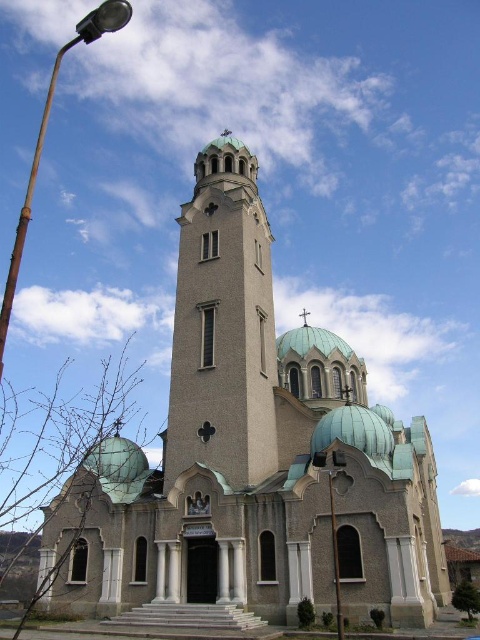
Is smooth concrete bell tower at center taller than metallic pole at lower center?

Correct, smooth concrete bell tower at center is much taller as metallic pole at lower center.

Between point (264, 460) and point (336, 596), which one is positioned in front?

Point (336, 596)

Is point (223, 202) farther from camera compared to point (333, 499)?

Yes, it is behind point (333, 499).

You are a GUI agent. You are given a task and a screenshot of the screen. Output one action in this format:
    pyautogui.click(x=<x>, y=<y>)
    Task: Click on the smooth concrete bell tower at center
    The image size is (480, 640).
    Given the screenshot: What is the action you would take?
    pyautogui.click(x=223, y=324)

Between smooth concrete bell tower at center and rusty metal streetlight at left, which one is positioned higher?

rusty metal streetlight at left is higher up.

Does smooth concrete bell tower at center appear on the left side of rusty metal streetlight at left?

In fact, smooth concrete bell tower at center is to the right of rusty metal streetlight at left.

Between point (195, 305) and point (20, 262), which one is positioned in front?

Positioned in front is point (195, 305).

The height and width of the screenshot is (640, 480). I want to click on smooth concrete bell tower at center, so click(223, 324).

Between point (225, 596) and point (225, 188), which one is positioned behind?

The point (225, 188) is behind.

The height and width of the screenshot is (640, 480). I want to click on beige stone church at center, so click(x=252, y=452).